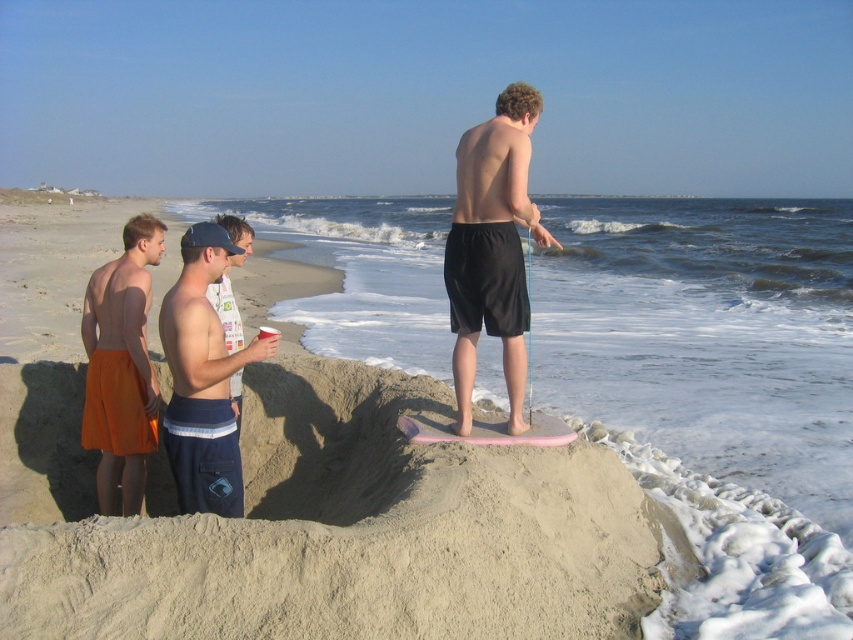
Question: Considering the relative positions of beige sandcastle at center and black matte shorts at center in the image provided, where is beige sandcastle at center located with respect to black matte shorts at center?

Choices:
 (A) right
 (B) left

Answer: (A)

Question: Does orange fabric shorts at left have a lesser width compared to white printed t-shirt at center?

Choices:
 (A) yes
 (B) no

Answer: (A)

Question: Considering the real-world distances, which object is closest to the black matte shorts at center?

Choices:
 (A) beige sandcastle at center
 (B) orange fabric shorts at left

Answer: (B)

Question: Is black matte shorts at center thinner than white printed t-shirt at center?

Choices:
 (A) yes
 (B) no

Answer: (A)

Question: Which point is closer to the camera?

Choices:
 (A) (138, 432)
 (B) (235, 308)

Answer: (A)

Question: Among these objects, which one is farthest from the camera?

Choices:
 (A) black matte shorts at center
 (B) orange fabric shorts at left

Answer: (A)